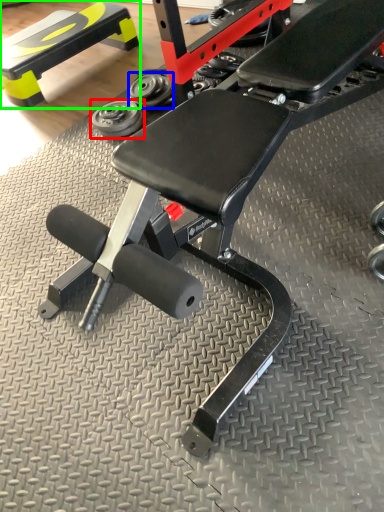
Question: Which object is the closest to the dumbbell (highlighted by a red box)? Choose among these: dumbbell (highlighted by a blue box) or bench (highlighted by a green box).

Choices:
 (A) dumbbell
 (B) bench

Answer: (A)